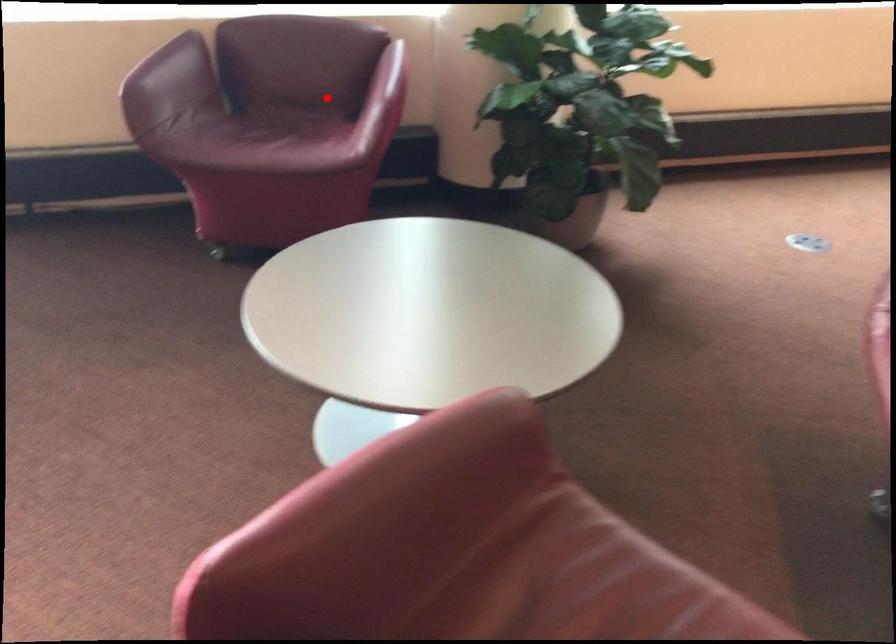
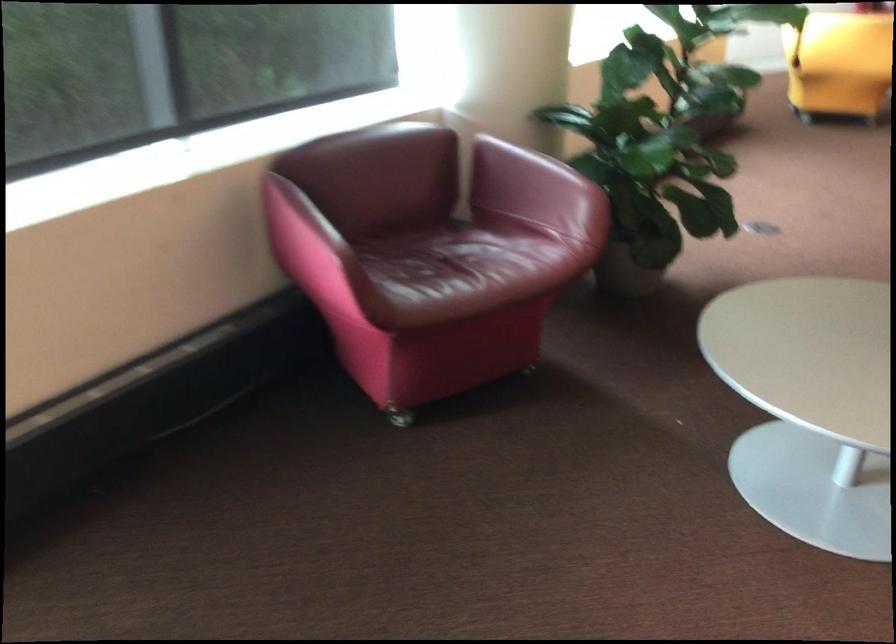
The point at the highlighted location is marked in the first image. Where is the corresponding point in the second image?

(426, 212)